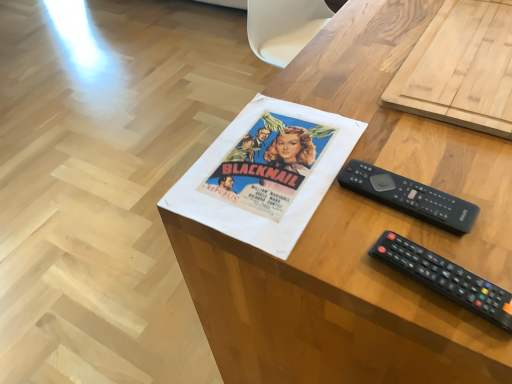
Where is `blank space to the left of black plastic remote at center right, the first remote control positioned from the top`? The height and width of the screenshot is (384, 512). blank space to the left of black plastic remote at center right, the first remote control positioned from the top is located at coordinates (282, 205).